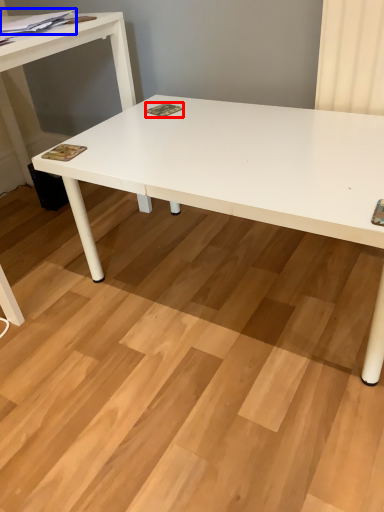
Question: Which point is closer to the camera, magazine (highlighted by a red box) or magazine (highlighted by a blue box)?

Choices:
 (A) magazine
 (B) magazine

Answer: (B)